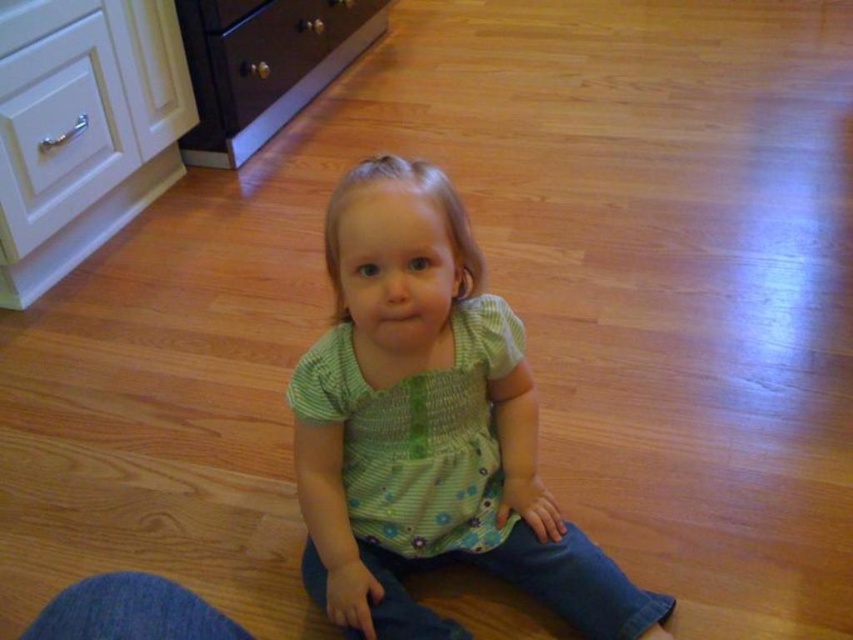
You are a parent looking for your child. You see the green floral shirt at center and the matte dark brown drawer at upper center in the image. Which object is closer to the child?

The green floral shirt at center is closer to the child because it is positioned below the matte dark brown drawer at upper center, indicating it is lower in the visual hierarchy and likely nearer in the scene.

You are a parent looking for a place to put a small decorative item. You see the white glossy dresser at upper left and the matte dark brown drawer at upper center. Which surface is lower and thus better suited for placing heavier items?

The white glossy dresser at upper left is located below the matte dark brown drawer at upper center, so it is lower and better suited for placing heavier items.

You are a photographer setting up a shoot in this room. You need to position a light source to the left of the white glossy dresser at upper left. Will the light source also be to the left of the green floral shirt at center?

The green floral shirt at center is to the right of the white glossy dresser at upper left, so placing the light source to the left of the white glossy dresser at upper left would mean the light source is also to the left of the green floral shirt at center.